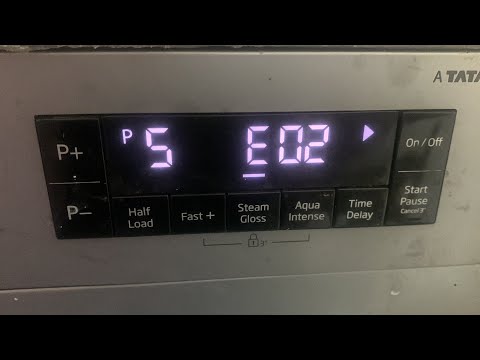
This screenshot has height=360, width=480. Identify the location of digital screen. (221, 179).